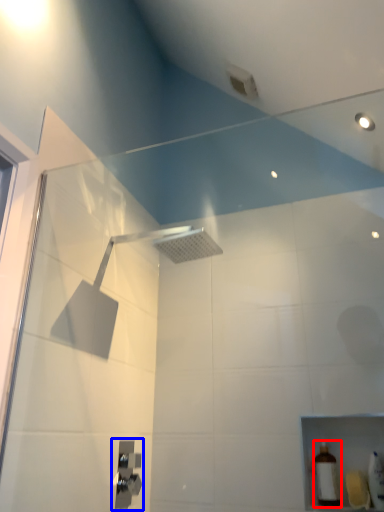
Question: Which object is further to the camera taking this photo, toiletry (highlighted by a red box) or shower (highlighted by a blue box)?

Choices:
 (A) toiletry
 (B) shower

Answer: (A)